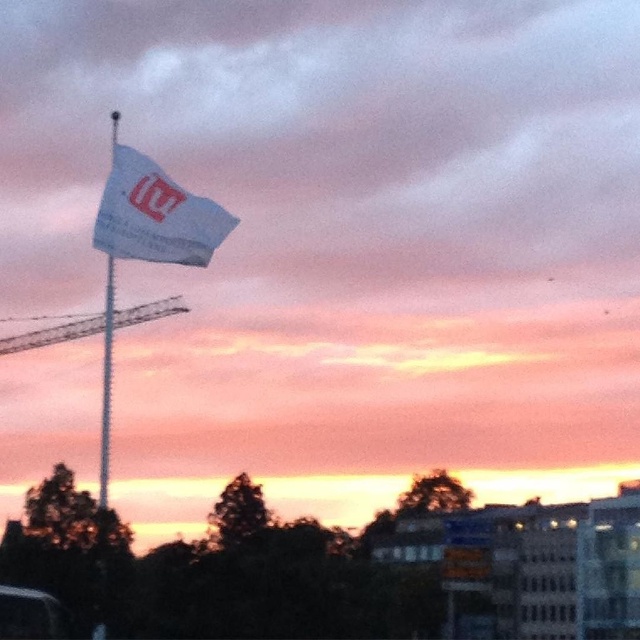
Which is below, white fabric flag at upper center or metallic gray crane at left?

metallic gray crane at left is lower down.

The height and width of the screenshot is (640, 640). I want to click on white fabric flag at upper center, so click(x=156, y=216).

Is point (113, 141) positioned before point (147, 317)?

No, it is behind (147, 317).

Where is `white fabric flag at upper center`? Image resolution: width=640 pixels, height=640 pixels. white fabric flag at upper center is located at coordinates (156, 216).

Looking at this image, does metallic gray crane at left appear on the right side of white fabric flagpole at upper left?

Incorrect, metallic gray crane at left is not on the right side of white fabric flagpole at upper left.

Who is positioned more to the right, metallic gray crane at left or white fabric flagpole at upper left?

From the viewer's perspective, white fabric flagpole at upper left appears more on the right side.

At what (x,y) coordinates should I click in order to perform the action: click on metallic gray crane at left. Please return your answer as a coordinate pair (x, y). The height and width of the screenshot is (640, 640). Looking at the image, I should click on (52, 333).

Does point (115, 154) lie in front of point (113, 132)?

Yes, it is.

Which is above, white fabric flag at upper center or white fabric flagpole at upper left?

white fabric flag at upper center is above.

What do you see at coordinates (156, 216) in the screenshot?
I see `white fabric flag at upper center` at bounding box center [156, 216].

The height and width of the screenshot is (640, 640). In order to click on white fabric flag at upper center in this screenshot , I will do `click(156, 216)`.